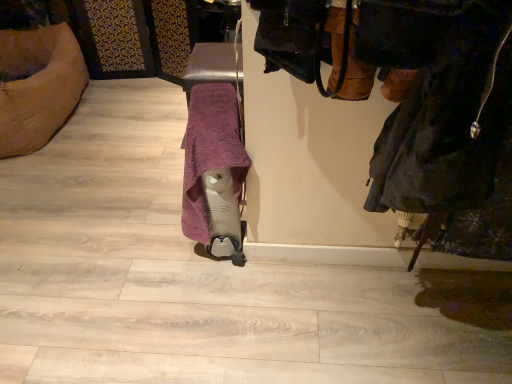
At what (x,y) coordinates should I click in order to perform the action: click on vacant space situated on the left part of purple soft towel at center. Please return your answer as a coordinate pair (x, y). Looking at the image, I should click on [143, 235].